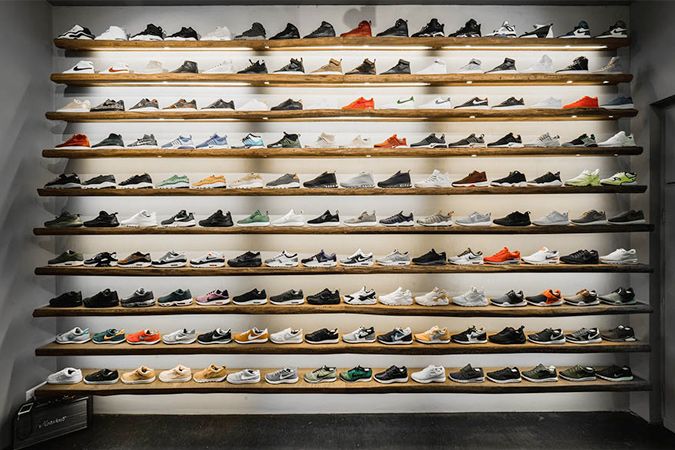
Locate an element on the screen. The image size is (675, 450). shelves below sneakers is located at coordinates (x=321, y=42), (x=321, y=77), (x=327, y=112), (x=329, y=152), (x=322, y=191), (x=321, y=228), (x=321, y=271), (x=321, y=309), (x=321, y=346), (x=322, y=384).